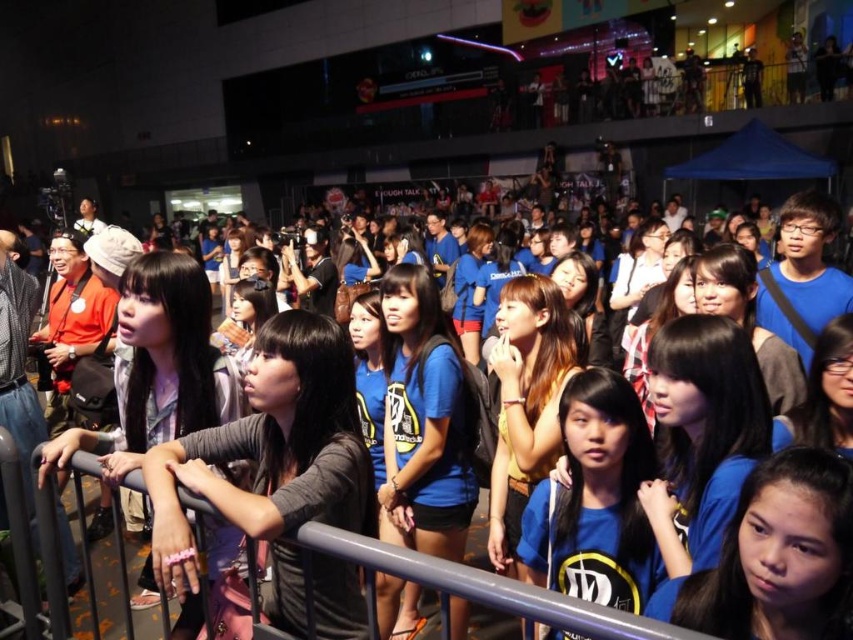
Question: Which object appears farthest from the camera in this image?

Choices:
 (A) blue fabric crowd at center
 (B) gray metallic rail at center

Answer: (A)

Question: Can you confirm if blue fabric crowd at center is thinner than gray metallic rail at center?

Choices:
 (A) no
 (B) yes

Answer: (B)

Question: Which point appears closest to the camera in this image?

Choices:
 (A) (340, 548)
 (B) (48, 531)

Answer: (A)

Question: Which object appears closest to the camera in this image?

Choices:
 (A) gray metallic rail at center
 (B) blue fabric crowd at center

Answer: (A)

Question: Does blue fabric crowd at center appear on the left side of gray metallic rail at center?

Choices:
 (A) no
 (B) yes

Answer: (B)

Question: Does blue fabric crowd at center appear under gray metallic rail at center?

Choices:
 (A) no
 (B) yes

Answer: (B)